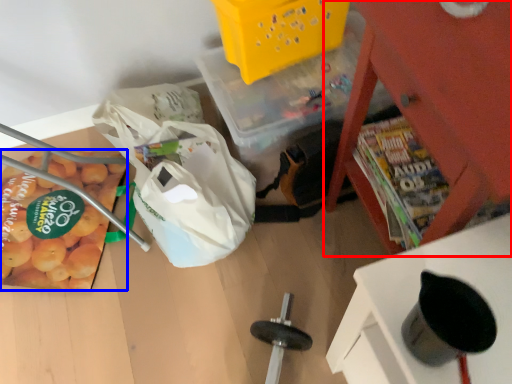
Question: Which object is closer to the camera taking this photo, furniture (highlighted by a red box) or vegetable (highlighted by a blue box)?

Choices:
 (A) furniture
 (B) vegetable

Answer: (A)